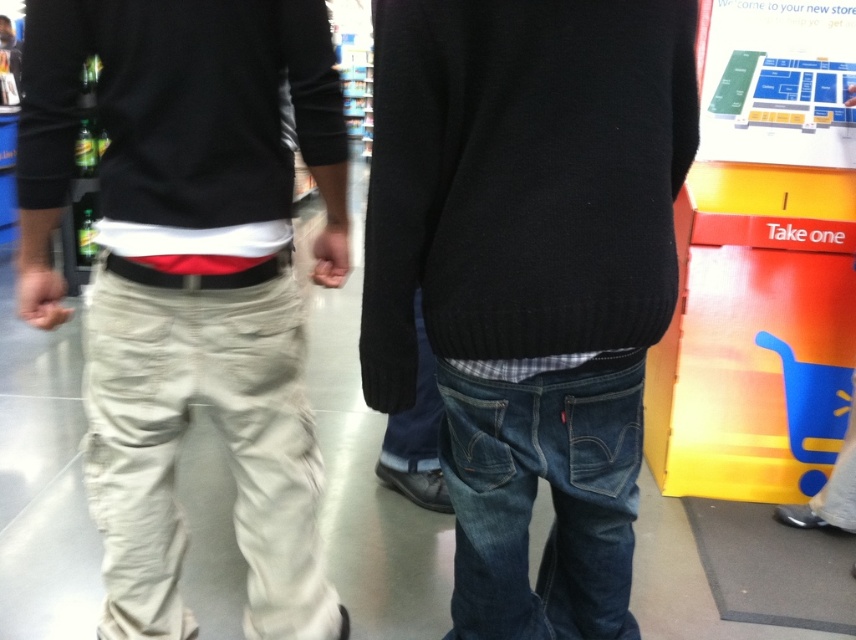
Based on the photo, can you confirm if khaki cotton pants at left is shorter than black leather sweatshirt at left?

In fact, khaki cotton pants at left may be taller than black leather sweatshirt at left.

Which of these two, khaki cotton pants at left or black leather sweatshirt at left, stands shorter?

black leather sweatshirt at left

Measure the distance between khaki cotton pants at left and camera.

A distance of 3.61 feet exists between khaki cotton pants at left and camera.

Locate an element on the screen. khaki cotton pants at left is located at coordinates (191, 280).

Is denim jeans at center thinner than black leather sweatshirt at left?

Yes, denim jeans at center is thinner than black leather sweatshirt at left.

Which is more to the left, denim jeans at center or black leather sweatshirt at left?

Positioned to the left is black leather sweatshirt at left.

Who is more forward, (x=631, y=65) or (x=33, y=36)?

Positioned in front is point (x=631, y=65).

In order to click on denim jeans at center in this screenshot , I will do `click(528, 276)`.

Is denim jeans at center below khaki cotton pants at left?

No, denim jeans at center is not below khaki cotton pants at left.

Who is taller, denim jeans at center or khaki cotton pants at left?

khaki cotton pants at left is taller.

This screenshot has height=640, width=856. Find the location of `denim jeans at center`. denim jeans at center is located at coordinates (528, 276).

Find the location of `denim jeans at center`. denim jeans at center is located at coordinates (528, 276).